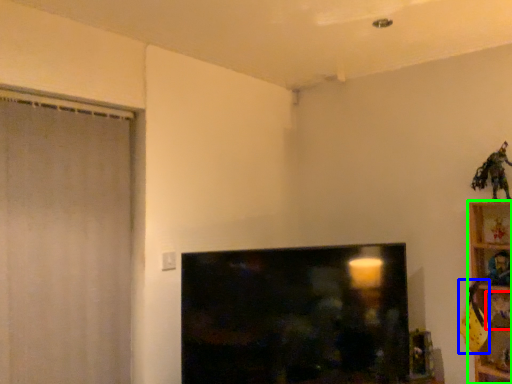
Question: Considering the real-world distances, which object is farthest from toy (highlighted by a red box)? toy (highlighted by a blue box) or furniture (highlighted by a green box)?

Choices:
 (A) toy
 (B) furniture

Answer: (B)